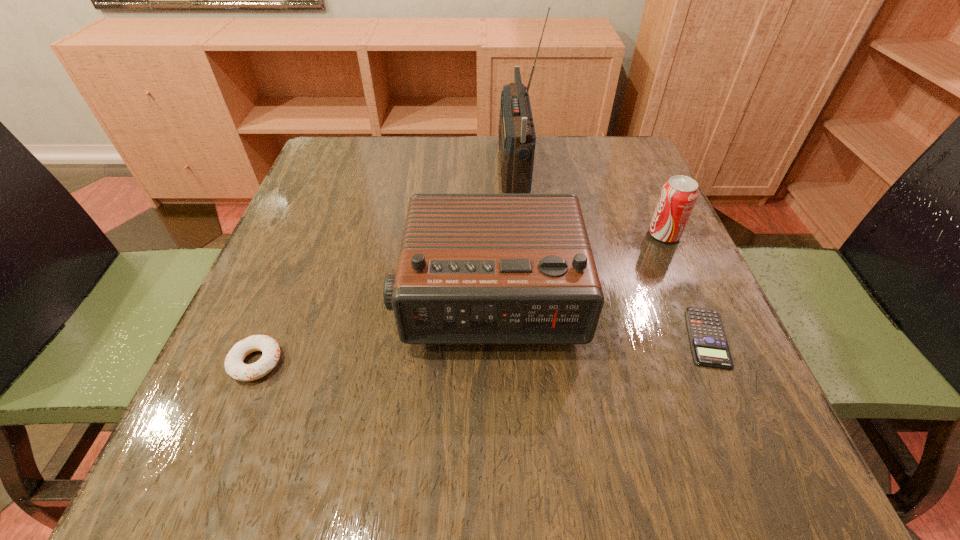
Where is `free space that satisfies the following two spatial constraints: 1. on the back side of the calculator; 2. on the front-facing side of the taller radio receiver`? The width and height of the screenshot is (960, 540). free space that satisfies the following two spatial constraints: 1. on the back side of the calculator; 2. on the front-facing side of the taller radio receiver is located at coordinates (632, 167).